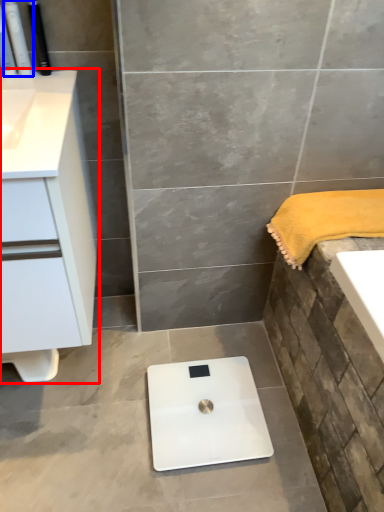
Question: Which point is closer to the camera, bathroom cabinet (highlighted by a red box) or toiletry (highlighted by a blue box)?

Choices:
 (A) bathroom cabinet
 (B) toiletry

Answer: (A)